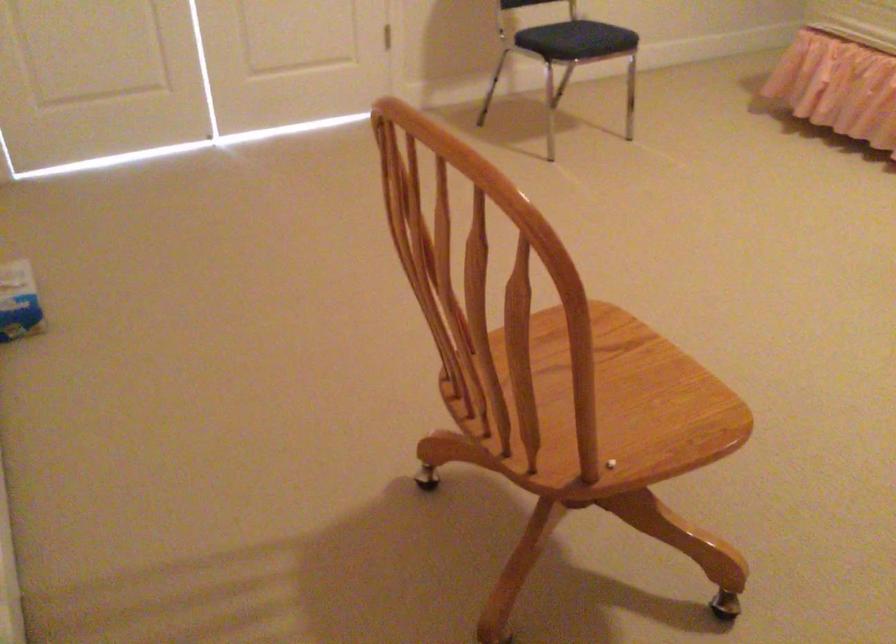
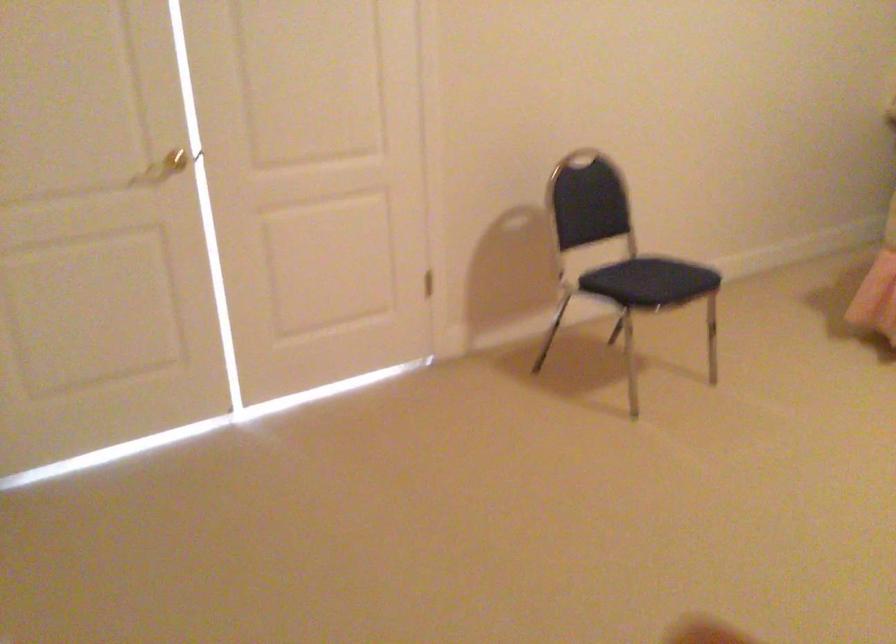
Which direction would the cameraman need to move to produce the second image?

The cameraman moved toward left, forward.